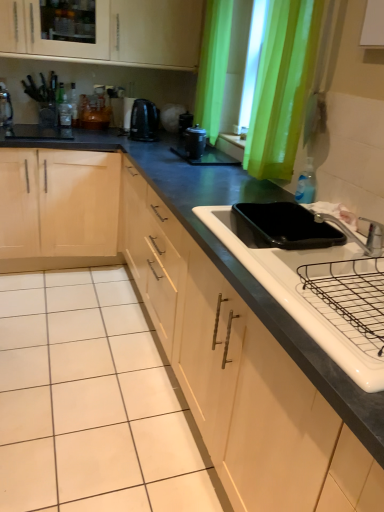
This screenshot has height=512, width=384. Identify the location of vacant space in front of green fabric curtain at upper right. (254, 188).